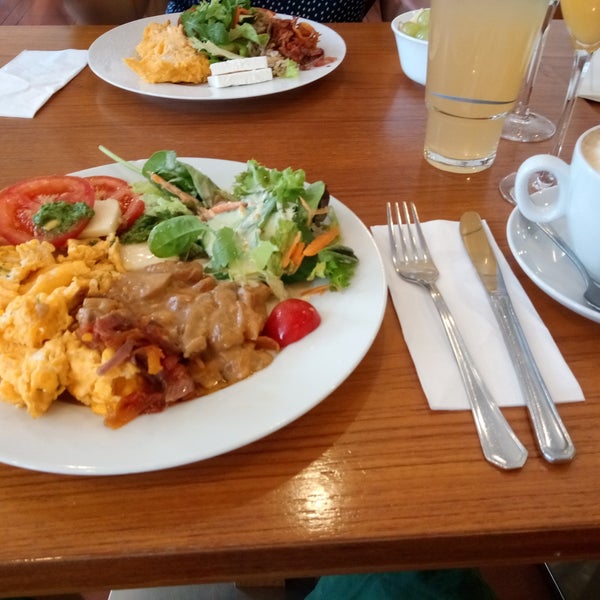
The width and height of the screenshot is (600, 600). Identify the location of napkin. (472, 325), (41, 78).